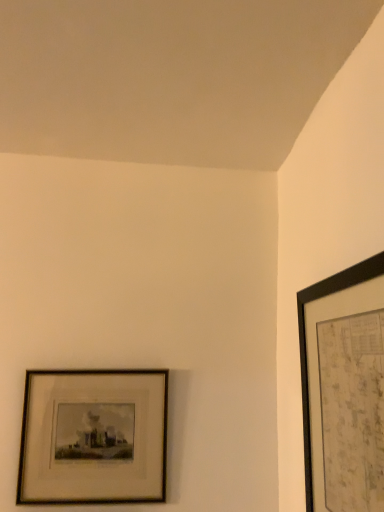
Question: Does black matte picture frame at upper right, which appears as the 1th picture frame when viewed from the front, have a smaller size compared to wooden framed print at lower left, which is the first picture frame in left-to-right order?

Choices:
 (A) no
 (B) yes

Answer: (A)

Question: Does black matte picture frame at upper right, arranged as the 1th picture frame when viewed from the right, appear on the right side of wooden framed print at lower left, placed as the 1th picture frame when sorted from back to front?

Choices:
 (A) no
 (B) yes

Answer: (B)

Question: From a real-world perspective, is black matte picture frame at upper right, which appears as the 1th picture frame when viewed from the front, physically above wooden framed print at lower left, placed as the 1th picture frame when sorted from back to front?

Choices:
 (A) no
 (B) yes

Answer: (B)

Question: From the image's perspective, would you say black matte picture frame at upper right, which appears as the 1th picture frame when viewed from the front, is positioned over wooden framed print at lower left, which is the first picture frame in left-to-right order?

Choices:
 (A) yes
 (B) no

Answer: (A)

Question: Is black matte picture frame at upper right, the second picture frame viewed from the back, next to wooden framed print at lower left, which is the first picture frame in left-to-right order?

Choices:
 (A) no
 (B) yes

Answer: (A)

Question: Considering the relative sizes of black matte picture frame at upper right, which appears as the 1th picture frame when viewed from the front, and wooden framed print at lower left, the second picture frame positioned from the right, in the image provided, is black matte picture frame at upper right, which appears as the 1th picture frame when viewed from the front, bigger than wooden framed print at lower left, the second picture frame positioned from the right,?

Choices:
 (A) no
 (B) yes

Answer: (B)

Question: Is wooden framed print at lower left, placed as the 1th picture frame when sorted from back to front, smaller than black matte picture frame at upper right, the 2th picture frame positioned from the left?

Choices:
 (A) no
 (B) yes

Answer: (B)

Question: Can you confirm if wooden framed print at lower left, placed as the 1th picture frame when sorted from back to front, is thinner than black matte picture frame at upper right, the second picture frame viewed from the back?

Choices:
 (A) no
 (B) yes

Answer: (B)

Question: Is wooden framed print at lower left, placed as the 1th picture frame when sorted from back to front, at the left side of black matte picture frame at upper right, which appears as the 1th picture frame when viewed from the front?

Choices:
 (A) no
 (B) yes

Answer: (B)

Question: Is wooden framed print at lower left, acting as the second picture frame starting from the front, beside black matte picture frame at upper right, arranged as the 1th picture frame when viewed from the right?

Choices:
 (A) yes
 (B) no

Answer: (B)

Question: Is wooden framed print at lower left, the second picture frame positioned from the right, looking in the opposite direction of black matte picture frame at upper right, the 2th picture frame positioned from the left?

Choices:
 (A) yes
 (B) no

Answer: (B)

Question: From the image's perspective, is wooden framed print at lower left, the second picture frame positioned from the right, located beneath black matte picture frame at upper right, arranged as the 1th picture frame when viewed from the right?

Choices:
 (A) yes
 (B) no

Answer: (A)

Question: Is black matte picture frame at upper right, arranged as the 1th picture frame when viewed from the right, inside the boundaries of wooden framed print at lower left, placed as the 1th picture frame when sorted from back to front, or outside?

Choices:
 (A) inside
 (B) outside

Answer: (B)